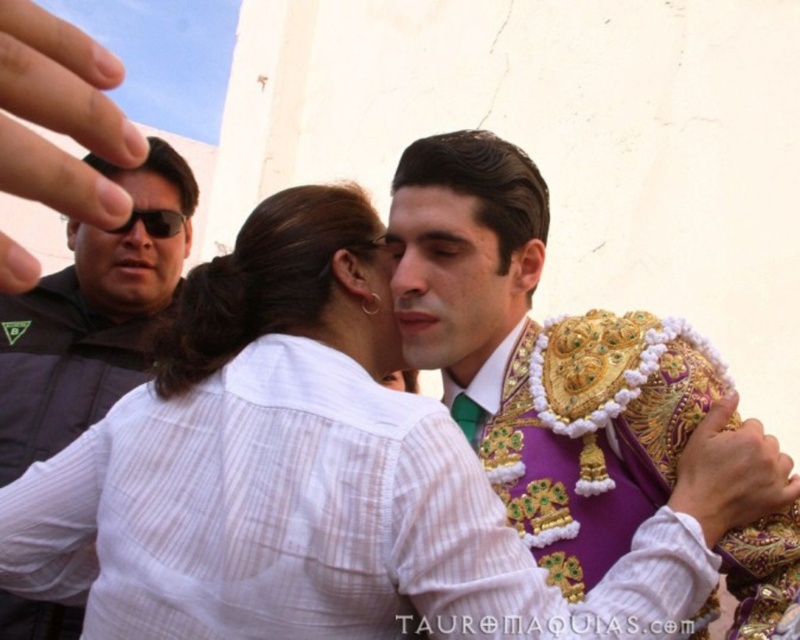
Question: Is the position of purple velvet vest at center less distant than that of black matte jacket at left?

Choices:
 (A) yes
 (B) no

Answer: (A)

Question: Can you confirm if purple velvet vest at center is positioned to the left of black matte jacket at left?

Choices:
 (A) yes
 (B) no

Answer: (B)

Question: Does purple velvet vest at center have a lesser width compared to black matte jacket at left?

Choices:
 (A) yes
 (B) no

Answer: (B)

Question: Which point is farther from the camera taking this photo?

Choices:
 (A) (49, 305)
 (B) (494, 451)

Answer: (A)

Question: Which point is farther to the camera?

Choices:
 (A) purple velvet vest at center
 (B) black matte jacket at left

Answer: (B)